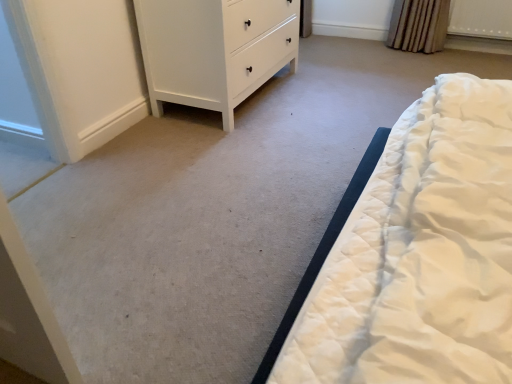
Question: Considering the positions of point (163, 13) and point (508, 29), is point (163, 13) closer or farther from the camera than point (508, 29)?

Choices:
 (A) farther
 (B) closer

Answer: (B)

Question: Based on their positions, is white matte chest of drawers at upper left located to the left or right of white plastic radiator at upper right?

Choices:
 (A) right
 (B) left

Answer: (B)

Question: In terms of height, does white matte chest of drawers at upper left look taller or shorter compared to white plastic radiator at upper right?

Choices:
 (A) tall
 (B) short

Answer: (A)

Question: Would you say white plastic radiator at upper right is inside or outside white matte chest of drawers at upper left?

Choices:
 (A) inside
 (B) outside

Answer: (B)

Question: Is white plastic radiator at upper right wider or thinner than white matte chest of drawers at upper left?

Choices:
 (A) wide
 (B) thin

Answer: (B)

Question: Based on their sizes in the image, would you say white plastic radiator at upper right is bigger or smaller than white matte chest of drawers at upper left?

Choices:
 (A) small
 (B) big

Answer: (A)

Question: Considering the positions of white plastic radiator at upper right and white matte chest of drawers at upper left in the image, is white plastic radiator at upper right taller or shorter than white matte chest of drawers at upper left?

Choices:
 (A) short
 (B) tall

Answer: (A)